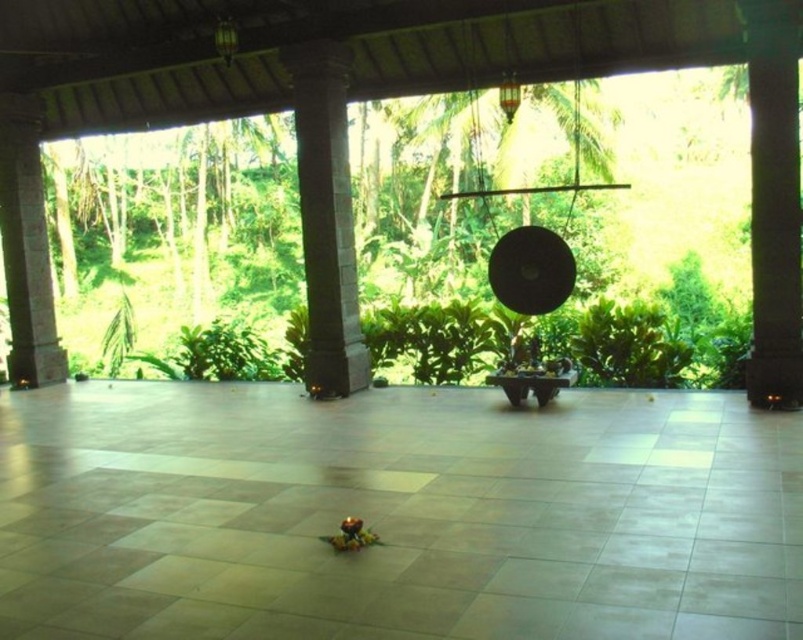
You are planning to hang a decorative banner between the gray stone pillar at center and the brown stone pillar at left. Which pillar should the banner be attached to if you want it closer to the center of the pavilion?

The gray stone pillar at center is larger in size than the brown stone pillar at left, so the banner should be attached to the gray stone pillar at center to be closer to the center of the pavilion.

You are standing in the open air pavilion and want to place a small statue exactly between the dark gray stone pillar at right and the gray stone pillar at center. According to their positions, which pillar should the statue be closer to?

The dark gray stone pillar at right is below the gray stone pillar at center, so the statue should be placed closer to the dark gray stone pillar at right since it is lower in position.